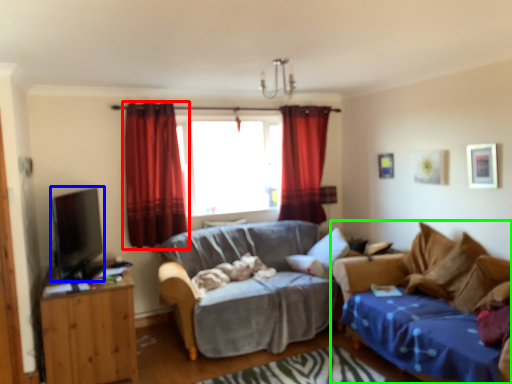
Question: Considering the real-world distances, which object is farthest from curtain (highlighted by a red box)? open (highlighted by a blue box) or studio couch (highlighted by a green box)?

Choices:
 (A) open
 (B) studio couch

Answer: (B)